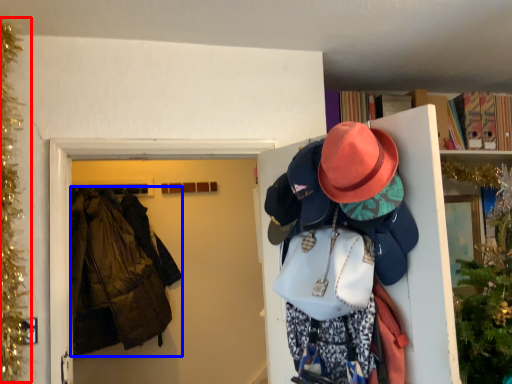
Question: Among these objects, which one is farthest to the camera, christmas decoration (highlighted by a red box) or jacket (highlighted by a blue box)?

Choices:
 (A) christmas decoration
 (B) jacket

Answer: (B)